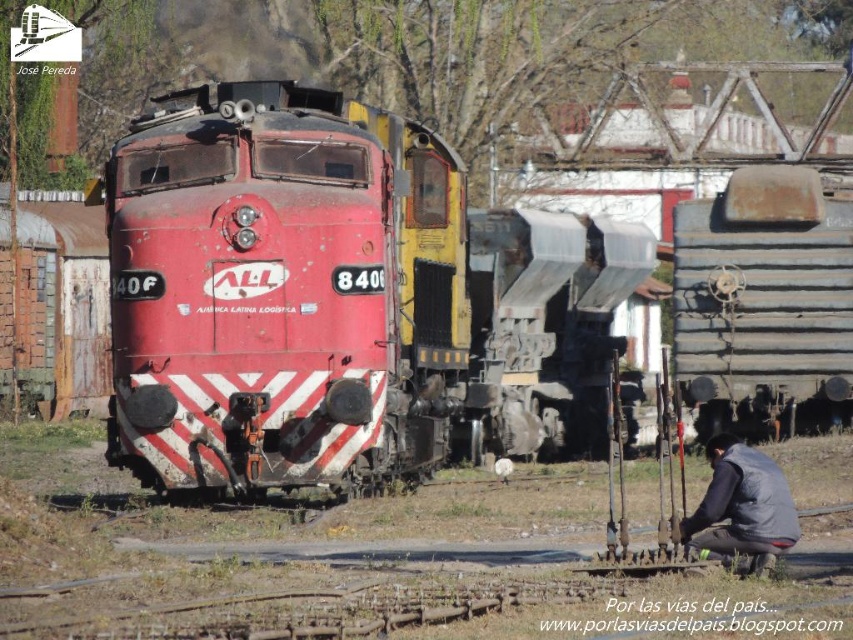
Does point (271, 221) lie behind point (746, 492)?

Yes, it is behind point (746, 492).

Which of these two, matte red locomotive at center or gray fabric squat at lower right, stands shorter?

With less height is matte red locomotive at center.

Locate an element on the screen. The height and width of the screenshot is (640, 853). matte red locomotive at center is located at coordinates (283, 291).

Between rusty metal train car at center and gray fabric squat at lower right, which one is positioned higher?

rusty metal train car at center

You are a GUI agent. You are given a task and a screenshot of the screen. Output one action in this format:
    pyautogui.click(x=<x>, y=<y>)
    Task: Click on the rusty metal train car at center
    
    Given the screenshot: What is the action you would take?
    pyautogui.click(x=547, y=324)

Where is `rusty metal train car at center`? The height and width of the screenshot is (640, 853). rusty metal train car at center is located at coordinates (547, 324).

From the picture: Is rusty metal train car at right closer to the viewer compared to gray fabric squat at lower right?

No, rusty metal train car at right is behind gray fabric squat at lower right.

Is point (820, 264) closer to viewer compared to point (770, 541)?

That is False.

Where is `rusty metal train car at right`? This screenshot has height=640, width=853. rusty metal train car at right is located at coordinates (764, 305).